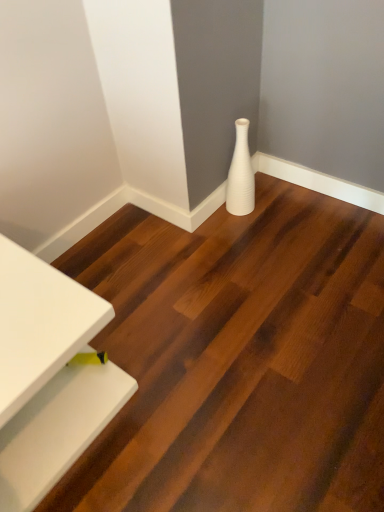
Question: Is white glossy table at lower left touching white glossy vase at center?

Choices:
 (A) yes
 (B) no

Answer: (B)

Question: Considering the relative positions of white glossy table at lower left and white glossy vase at center in the image provided, is white glossy table at lower left behind white glossy vase at center?

Choices:
 (A) no
 (B) yes

Answer: (B)

Question: Does white glossy table at lower left have a larger size compared to white glossy vase at center?

Choices:
 (A) no
 (B) yes

Answer: (A)

Question: Does white glossy table at lower left have a smaller size compared to white glossy vase at center?

Choices:
 (A) no
 (B) yes

Answer: (B)

Question: Does white glossy table at lower left have a greater height compared to white glossy vase at center?

Choices:
 (A) yes
 (B) no

Answer: (A)

Question: In the image, is white ribbed vase at lower right positioned in front of or behind white glossy table at lower left?

Choices:
 (A) front
 (B) behind

Answer: (B)

Question: From the image's perspective, is white ribbed vase at lower right above or below white glossy table at lower left?

Choices:
 (A) above
 (B) below

Answer: (A)

Question: Considering the positions of white ribbed vase at lower right and white glossy table at lower left in the image, is white ribbed vase at lower right bigger or smaller than white glossy table at lower left?

Choices:
 (A) big
 (B) small

Answer: (B)

Question: From a real-world perspective, relative to white glossy table at lower left, is white ribbed vase at lower right vertically above or below?

Choices:
 (A) below
 (B) above

Answer: (A)

Question: Is point (269, 281) positioned closer to the camera than point (24, 432)?

Choices:
 (A) closer
 (B) farther

Answer: (B)

Question: From a real-world perspective, is white glossy vase at center above or below white glossy table at lower left?

Choices:
 (A) below
 (B) above

Answer: (A)

Question: From their relative heights in the image, would you say white glossy vase at center is taller or shorter than white glossy table at lower left?

Choices:
 (A) short
 (B) tall

Answer: (A)

Question: Is white glossy vase at center wider or thinner than white glossy table at lower left?

Choices:
 (A) thin
 (B) wide

Answer: (B)

Question: From the image's perspective, relative to white ribbed vase at lower right, is white glossy table at lower left above or below?

Choices:
 (A) below
 (B) above

Answer: (A)

Question: Do you think white glossy table at lower left is within white ribbed vase at lower right, or outside of it?

Choices:
 (A) inside
 (B) outside

Answer: (B)